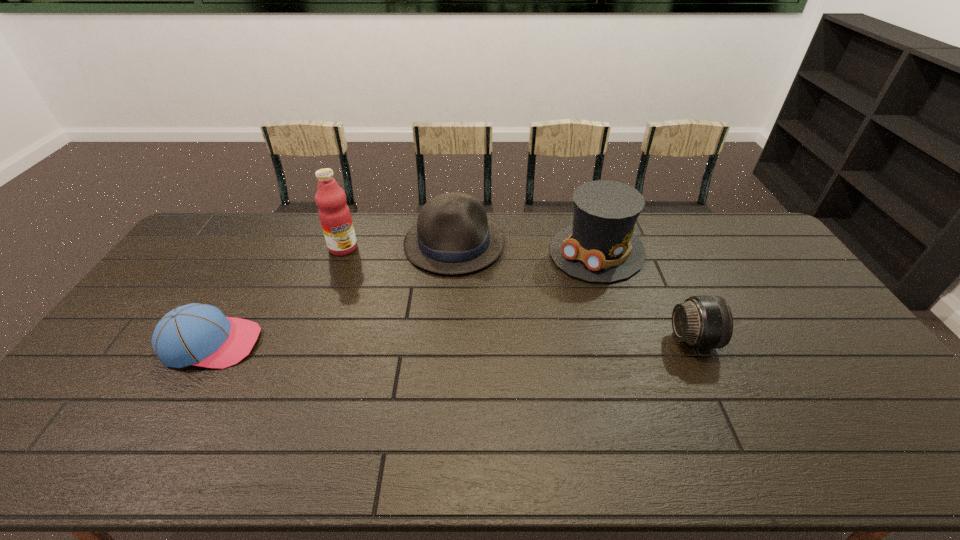
At what (x,y) coordinates should I click in order to perform the action: click on vacant space that satisfies the following two spatial constraints: 1. on the front side of the telephoto lens; 2. on the front-facing side of the third tallest object. Please return your answer as a coordinate pair (x, y). Image resolution: width=960 pixels, height=540 pixels. Looking at the image, I should click on (447, 339).

At what (x,y) coordinates should I click in order to perform the action: click on free region that satisfies the following two spatial constraints: 1. on the front side of the fourth object from right to left; 2. on the front-facing side of the telephoto lens. Please return your answer as a coordinate pair (x, y). The height and width of the screenshot is (540, 960). Looking at the image, I should click on (309, 339).